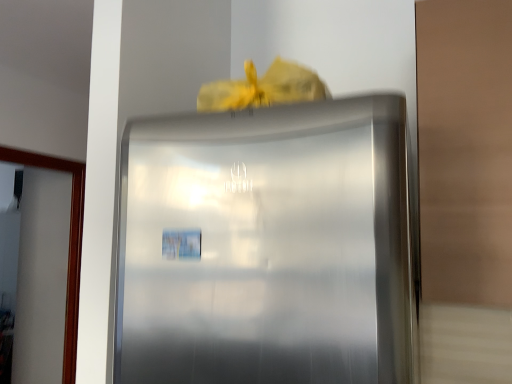
Question: Does satin silver refrigerator at center have a greater width compared to transparent glass door at left?

Choices:
 (A) no
 (B) yes

Answer: (B)

Question: Can we say satin silver refrigerator at center lies outside transparent glass door at left?

Choices:
 (A) yes
 (B) no

Answer: (A)

Question: Is satin silver refrigerator at center bigger than transparent glass door at left?

Choices:
 (A) no
 (B) yes

Answer: (B)

Question: From the image's perspective, is satin silver refrigerator at center under transparent glass door at left?

Choices:
 (A) yes
 (B) no

Answer: (B)

Question: Is satin silver refrigerator at center in front of transparent glass door at left?

Choices:
 (A) yes
 (B) no

Answer: (A)

Question: From the image's perspective, would you say satin silver refrigerator at center is positioned over transparent glass door at left?

Choices:
 (A) yes
 (B) no

Answer: (A)

Question: Does transparent glass door at left have a greater width compared to satin silver refrigerator at center?

Choices:
 (A) no
 (B) yes

Answer: (A)

Question: Can you confirm if transparent glass door at left is taller than satin silver refrigerator at center?

Choices:
 (A) yes
 (B) no

Answer: (A)

Question: Is transparent glass door at left positioned with its back to satin silver refrigerator at center?

Choices:
 (A) yes
 (B) no

Answer: (B)

Question: Is transparent glass door at left beside satin silver refrigerator at center?

Choices:
 (A) no
 (B) yes

Answer: (A)

Question: Would you say transparent glass door at left is outside satin silver refrigerator at center?

Choices:
 (A) no
 (B) yes

Answer: (B)

Question: Does transparent glass door at left have a lesser width compared to satin silver refrigerator at center?

Choices:
 (A) yes
 (B) no

Answer: (A)

Question: Based on their sizes in the image, would you say satin silver refrigerator at center is bigger or smaller than transparent glass door at left?

Choices:
 (A) big
 (B) small

Answer: (A)